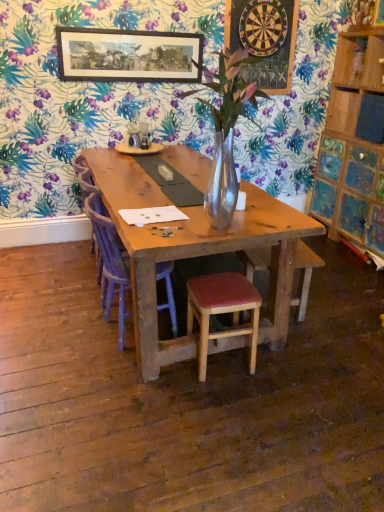
This screenshot has height=512, width=384. I want to click on free space above wooden framed print at upper center (from a real-world perspective), so click(130, 31).